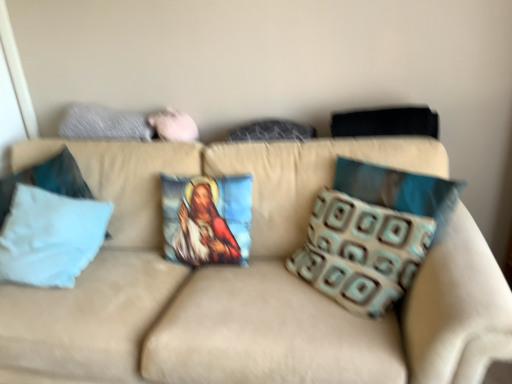
Question: Does white fabric pillow at left, arranged as the seventh pillow when viewed from the right, contain white fabric pillow at left, the 2th pillow in the left-to-right sequence?

Choices:
 (A) no
 (B) yes

Answer: (A)

Question: Is white fabric pillow at left, arranged as the seventh pillow when viewed from the right, looking in the opposite direction of white fabric pillow at left, the 6th pillow from the right?

Choices:
 (A) yes
 (B) no

Answer: (A)

Question: Is white fabric pillow at left, arranged as the 1th pillow when viewed from the left, to the right of white fabric pillow at left, the 6th pillow from the right, from the viewer's perspective?

Choices:
 (A) no
 (B) yes

Answer: (A)

Question: Is white fabric pillow at left, arranged as the seventh pillow when viewed from the right, completely or partially outside of white fabric pillow at left, the 2th pillow in the left-to-right sequence?

Choices:
 (A) no
 (B) yes

Answer: (B)

Question: Is the surface of white fabric pillow at left, arranged as the 1th pillow when viewed from the left, in direct contact with white fabric pillow at left, the 6th pillow from the right?

Choices:
 (A) yes
 (B) no

Answer: (B)

Question: From the image's perspective, relative to brown patterned pillow at right, marked as the 7th pillow in a left-to-right arrangement, is printed fabric pillow with religious image at center, placed as the fourth pillow when sorted from right to left, above or below?

Choices:
 (A) above
 (B) below

Answer: (B)

Question: Considering the positions of point 167,193 and point 458,196, is point 167,193 closer or farther from the camera than point 458,196?

Choices:
 (A) closer
 (B) farther

Answer: (B)

Question: Is printed fabric pillow with religious image at center, the 4th pillow from the left, to the left or to the right of brown patterned pillow at right, marked as the 7th pillow in a left-to-right arrangement, in the image?

Choices:
 (A) left
 (B) right

Answer: (A)

Question: Is printed fabric pillow with religious image at center, the 4th pillow from the left, bigger or smaller than brown patterned pillow at right, marked as the 7th pillow in a left-to-right arrangement?

Choices:
 (A) big
 (B) small

Answer: (B)

Question: From the image's perspective, is textured gray pillow at upper left, the 3th pillow positioned from the left, located above or below brown patterned pillow at right, marked as the 7th pillow in a left-to-right arrangement?

Choices:
 (A) below
 (B) above

Answer: (B)

Question: Is point (150, 127) closer or farther from the camera than point (352, 162)?

Choices:
 (A) closer
 (B) farther

Answer: (B)

Question: Is textured gray pillow at upper left, the 3th pillow positioned from the left, bigger or smaller than brown patterned pillow at right, the 1th pillow positioned from the right?

Choices:
 (A) big
 (B) small

Answer: (B)

Question: Considering the positions of textured gray pillow at upper left, placed as the fifth pillow when sorted from right to left, and brown patterned pillow at right, the 1th pillow positioned from the right, in the image, is textured gray pillow at upper left, placed as the fifth pillow when sorted from right to left, wider or thinner than brown patterned pillow at right, the 1th pillow positioned from the right,?

Choices:
 (A) thin
 (B) wide

Answer: (B)

Question: Considering the positions of white fabric pillow at left, arranged as the seventh pillow when viewed from the right, and textured fabric pillow at center, which is the third pillow in right-to-left order, in the image, is white fabric pillow at left, arranged as the seventh pillow when viewed from the right, bigger or smaller than textured fabric pillow at center, which is the third pillow in right-to-left order,?

Choices:
 (A) small
 (B) big

Answer: (B)

Question: Would you say white fabric pillow at left, arranged as the seventh pillow when viewed from the right, is inside or outside textured fabric pillow at center, arranged as the fifth pillow when viewed from the left?

Choices:
 (A) outside
 (B) inside

Answer: (A)